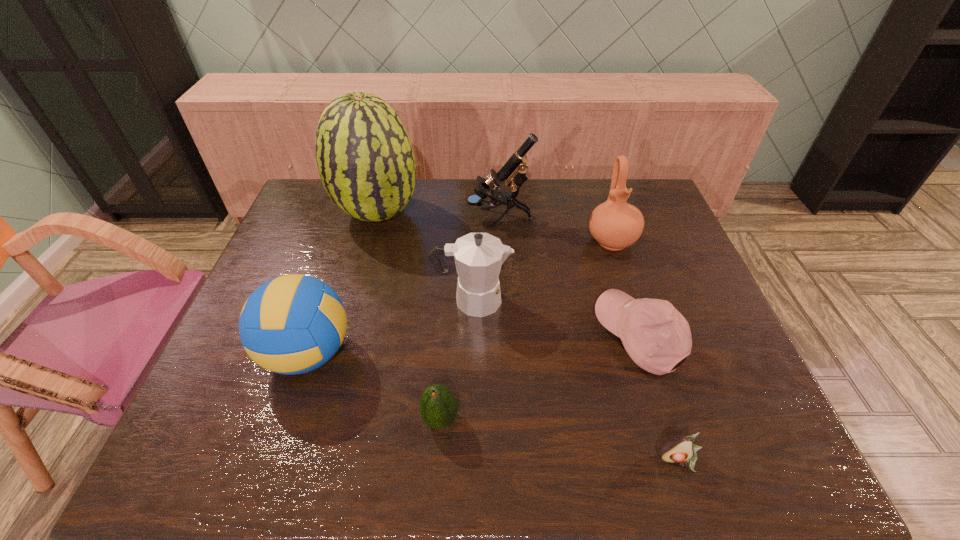
Identify the location of vacant space located 0.360m on the right of the farther avocado. (629, 419).

At what (x,y) coordinates should I click in order to perform the action: click on watermelon at the far edge. Please return your answer as a coordinate pair (x, y). This screenshot has width=960, height=540. Looking at the image, I should click on (365, 159).

Where is `microscope that is positioned at the far edge`? microscope that is positioned at the far edge is located at coordinates (514, 170).

I want to click on watermelon that is at the left edge, so click(x=365, y=159).

You are a GUI agent. You are given a task and a screenshot of the screen. Output one action in this format:
    pyautogui.click(x=<x>, y=<y>)
    Task: Click on the volleyball positioned at the left edge
    
    Given the screenshot: What is the action you would take?
    pyautogui.click(x=292, y=324)

Where is `pottery located at the right edge`? The height and width of the screenshot is (540, 960). pottery located at the right edge is located at coordinates (614, 224).

At what (x,y) coordinates should I click in order to perform the action: click on baseball cap at the right edge. Please return your answer as a coordinate pair (x, y). Looking at the image, I should click on (656, 336).

What are the coordinates of `object at the far left corner` in the screenshot? It's located at (x=365, y=159).

Find the location of a particular element. vacant position at the far edge of the desktop is located at coordinates (540, 186).

This screenshot has height=540, width=960. In the image, there is a desktop. Find the location of `vacant region at the near edge`. vacant region at the near edge is located at coordinates (676, 467).